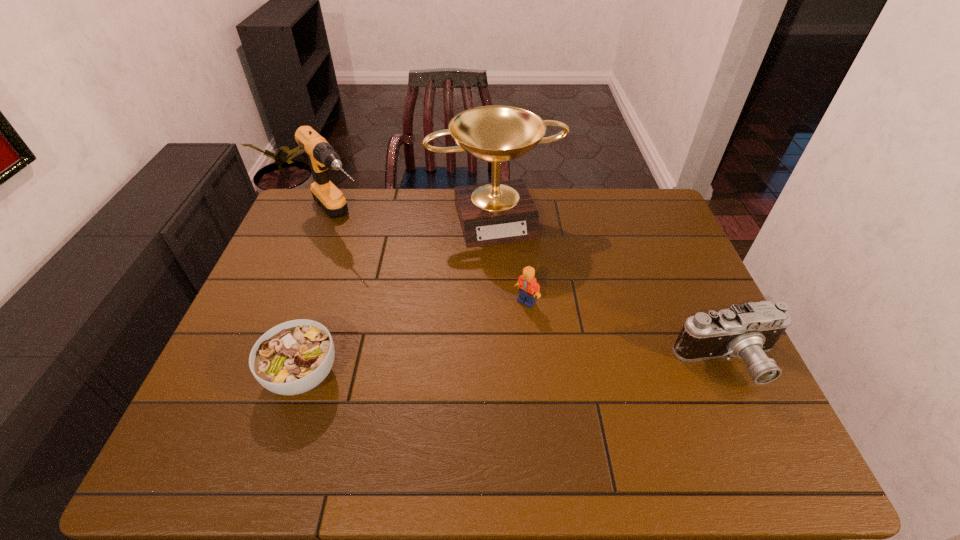
Image resolution: width=960 pixels, height=540 pixels. In order to click on soup bowl present at the left edge in this screenshot , I will do `click(293, 357)`.

This screenshot has height=540, width=960. Find the location of `drill located at the left edge`. drill located at the left edge is located at coordinates (322, 156).

In order to click on object present at the right edge in this screenshot , I will do `click(747, 331)`.

Identify the location of object located in the far left corner section of the desktop. This screenshot has height=540, width=960. (322, 156).

In order to click on object located in the near left corner section of the desktop in this screenshot , I will do `click(293, 357)`.

This screenshot has width=960, height=540. Find the location of `object situated at the near right corner`. object situated at the near right corner is located at coordinates (747, 331).

Image resolution: width=960 pixels, height=540 pixels. I want to click on free region at the far edge, so click(608, 192).

Where is `vacant space at the near edge of the desktop`? The height and width of the screenshot is (540, 960). vacant space at the near edge of the desktop is located at coordinates (551, 389).

Where is `vacant space at the left edge`? vacant space at the left edge is located at coordinates (265, 327).

The width and height of the screenshot is (960, 540). I want to click on vacant space at the right edge, so click(x=657, y=244).